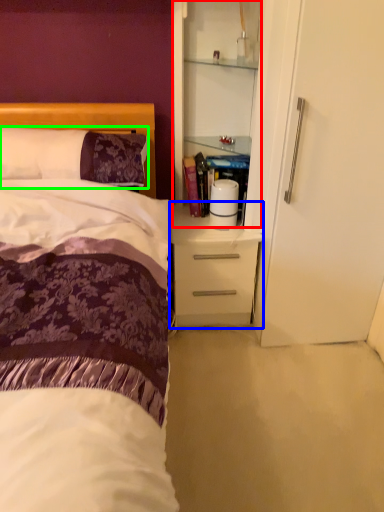
Question: Considering the real-world distances, which object is farthest from cabinetry (highlighted by a red box)? desk (highlighted by a blue box) or pillow (highlighted by a green box)?

Choices:
 (A) desk
 (B) pillow

Answer: (B)